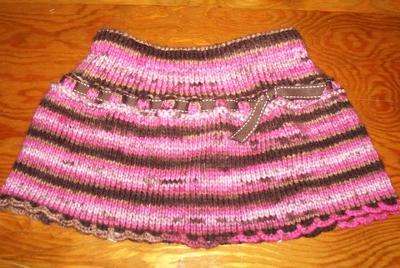
Find the location of a particular element. The width and height of the screenshot is (400, 268). light is located at coordinates (162, 258).